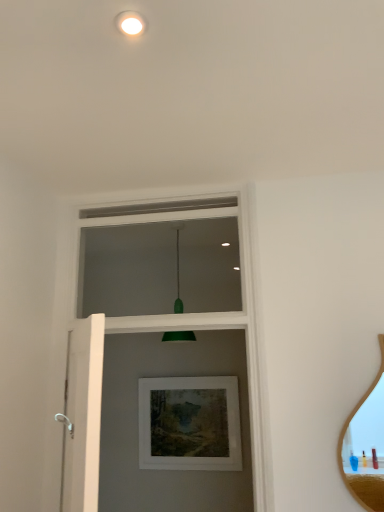
Question: Does white matte screen door at left come in front of green matte droplight at upper center?

Choices:
 (A) yes
 (B) no

Answer: (B)

Question: From a real-world perspective, is white matte screen door at left beneath green matte droplight at upper center?

Choices:
 (A) no
 (B) yes

Answer: (B)

Question: From the image's perspective, is white matte screen door at left above green matte droplight at upper center?

Choices:
 (A) no
 (B) yes

Answer: (A)

Question: Is white matte screen door at left positioned beyond the bounds of green matte droplight at upper center?

Choices:
 (A) no
 (B) yes

Answer: (B)

Question: Does white matte screen door at left have a smaller size compared to green matte droplight at upper center?

Choices:
 (A) yes
 (B) no

Answer: (B)

Question: Is white matte screen door at left not close to green matte droplight at upper center?

Choices:
 (A) yes
 (B) no

Answer: (A)

Question: Is matte white picture frame at center oriented towards white painted wood at upper center?

Choices:
 (A) yes
 (B) no

Answer: (B)

Question: Can you confirm if matte white picture frame at center is bigger than white painted wood at upper center?

Choices:
 (A) no
 (B) yes

Answer: (A)

Question: Is white painted wood at upper center surrounded by matte white picture frame at center?

Choices:
 (A) no
 (B) yes

Answer: (A)

Question: From the image's perspective, is matte white picture frame at center above white painted wood at upper center?

Choices:
 (A) yes
 (B) no

Answer: (B)

Question: Is matte white picture frame at center not within white painted wood at upper center?

Choices:
 (A) yes
 (B) no

Answer: (A)

Question: Does matte white picture frame at center have a greater width compared to white painted wood at upper center?

Choices:
 (A) no
 (B) yes

Answer: (A)

Question: From a real-world perspective, is matte white picture frame at center over wooden mirror at right?

Choices:
 (A) no
 (B) yes

Answer: (A)